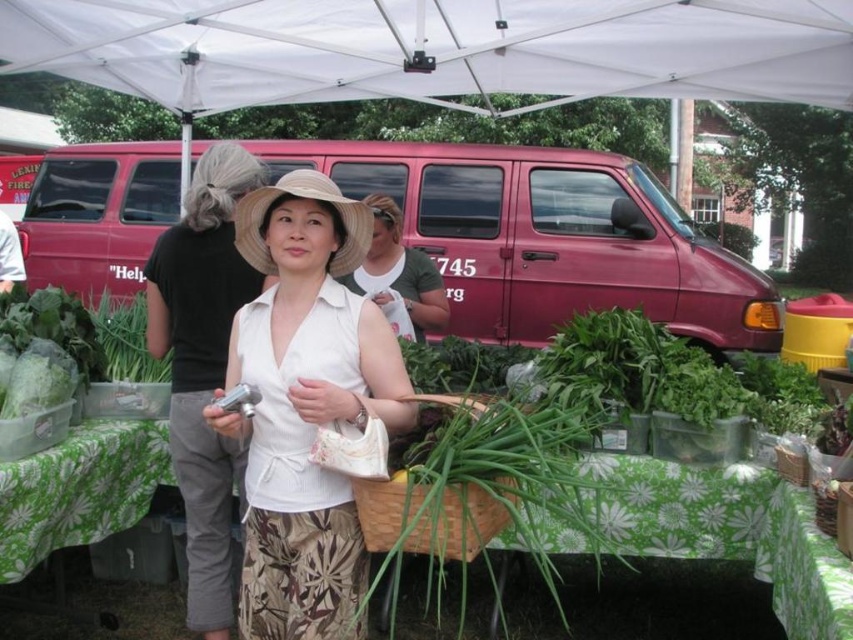
Can you confirm if green floral tablecloth at lower left is positioned to the left of beige straw hat at center?

Correct, you'll find green floral tablecloth at lower left to the left of beige straw hat at center.

Between point (167, 458) and point (293, 170), which one is positioned in front?

Point (167, 458) is in front.

Find the location of a particular element. The width and height of the screenshot is (853, 640). green floral tablecloth at lower left is located at coordinates (79, 490).

Does white matte hat at upper center have a greater width compared to green floral tablecloth at lower left?

Indeed, white matte hat at upper center has a greater width compared to green floral tablecloth at lower left.

In order to click on white matte hat at upper center in this screenshot , I will do `click(202, 364)`.

Who is more distant from viewer, (x=195, y=324) or (x=15, y=524)?

Positioned behind is point (x=195, y=324).

Identify the location of white matte hat at upper center. (202, 364).

Which is behind, point (140, 24) or point (22, 509)?

The point (140, 24) is behind.

Which is more to the right, white fabric canopy at upper center or green floral tablecloth at lower left?

From the viewer's perspective, white fabric canopy at upper center appears more on the right side.

Does point (728, 32) come closer to viewer compared to point (148, 502)?

No, it is behind (148, 502).

Locate an element on the screen. The width and height of the screenshot is (853, 640). white fabric canopy at upper center is located at coordinates (434, 49).